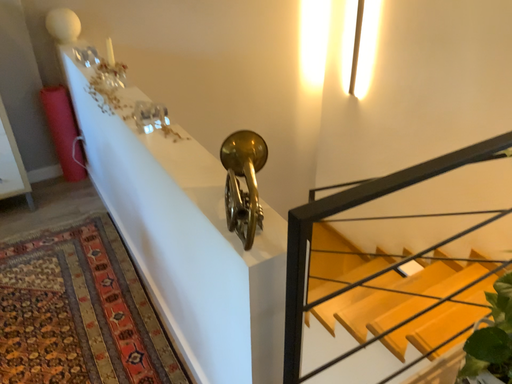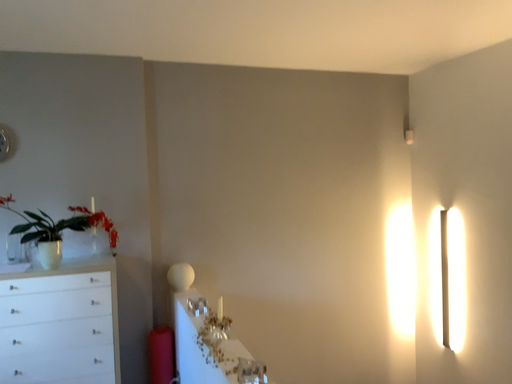
Question: How did the camera likely rotate when shooting the video?

Choices:
 (A) rotated right
 (B) rotated left

Answer: (B)